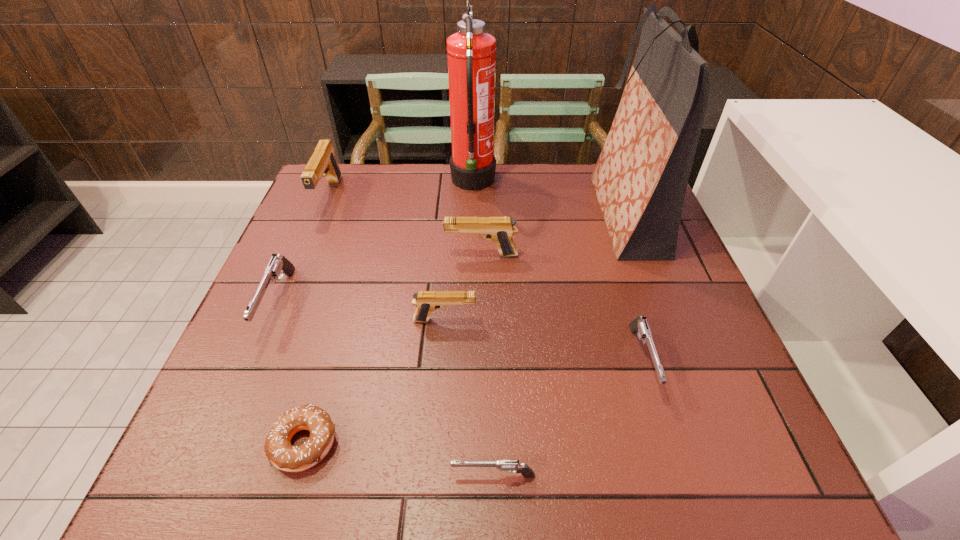
Find the location of a particular element. Image resolution: width=960 pixels, height=540 pixels. shopping bag present at the far edge is located at coordinates (640, 179).

Find the location of a particular element. This screenshot has width=960, height=540. pistol present at the far edge is located at coordinates (322, 163).

This screenshot has width=960, height=540. Identify the location of pistol present at the near edge. (511, 466).

You are a GUI agent. You are given a task and a screenshot of the screen. Output one action in this format:
    pyautogui.click(x=<x>, y=<y>)
    Task: Click on the doughnut located in the near edge section of the desktop
    
    Given the screenshot: What is the action you would take?
    pyautogui.click(x=278, y=449)

Identify the location of doughnut that is at the left edge. (278, 449).

Locate an element on the screen. Image resolution: width=960 pixels, height=540 pixels. object located in the right edge section of the desktop is located at coordinates (640, 179).

Find the location of a particular element. object located in the far left corner section of the desktop is located at coordinates (322, 163).

Find the location of `object present at the near left corner`. object present at the near left corner is located at coordinates (278, 449).

Find the location of a particular element. The height and width of the screenshot is (540, 960). object positioned at the far right corner is located at coordinates (640, 179).

At what (x,y) coordinates should I click in order to perform the action: click on vacant region at the far edge of the desktop. Please return your answer as a coordinate pair (x, y). This screenshot has height=540, width=960. Looking at the image, I should click on (406, 184).